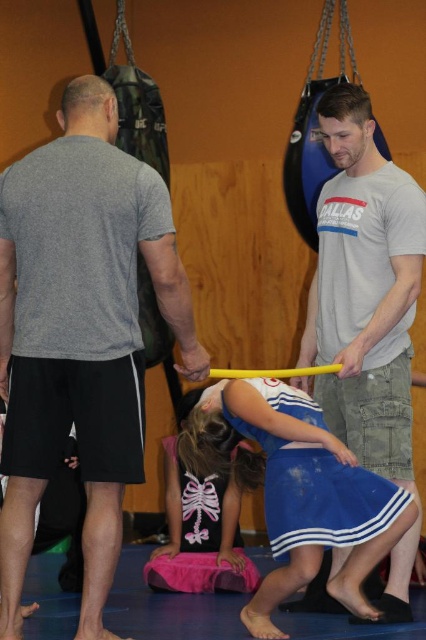
Does blue cotton cheerleader skirt at lower center have a smaller size compared to pink fabric at center?

Incorrect, blue cotton cheerleader skirt at lower center is not smaller in size than pink fabric at center.

Which is more to the left, blue cotton cheerleader skirt at lower center or pink fabric at center?

pink fabric at center

Describe the element at coordinates (299, 492) in the screenshot. I see `blue cotton cheerleader skirt at lower center` at that location.

You are a GUI agent. You are given a task and a screenshot of the screen. Output one action in this format:
    pyautogui.click(x=<x>, y=<y>)
    Task: Click on the blue cotton cheerleader skirt at lower center
    This screenshot has height=640, width=426.
    Given the screenshot: What is the action you would take?
    pyautogui.click(x=299, y=492)

Is gray matte t-shirt at left below blue cotton cheerleader skirt at lower center?

No, gray matte t-shirt at left is not below blue cotton cheerleader skirt at lower center.

Is gray matte t-shirt at left thinner than blue cotton cheerleader skirt at lower center?

Yes.

Does point (78, 204) come in front of point (330, 504)?

That is True.

The image size is (426, 640). I want to click on gray matte t-shirt at left, so click(x=80, y=332).

Can you confirm if gray matte t-shirt at left is positioned below pink fabric at center?

No, gray matte t-shirt at left is not below pink fabric at center.

Is point (109, 209) positioned behind point (253, 483)?

No.

What do you see at coordinates (80, 332) in the screenshot?
I see `gray matte t-shirt at left` at bounding box center [80, 332].

Where is `gray matte t-shirt at left`? This screenshot has height=640, width=426. gray matte t-shirt at left is located at coordinates (80, 332).